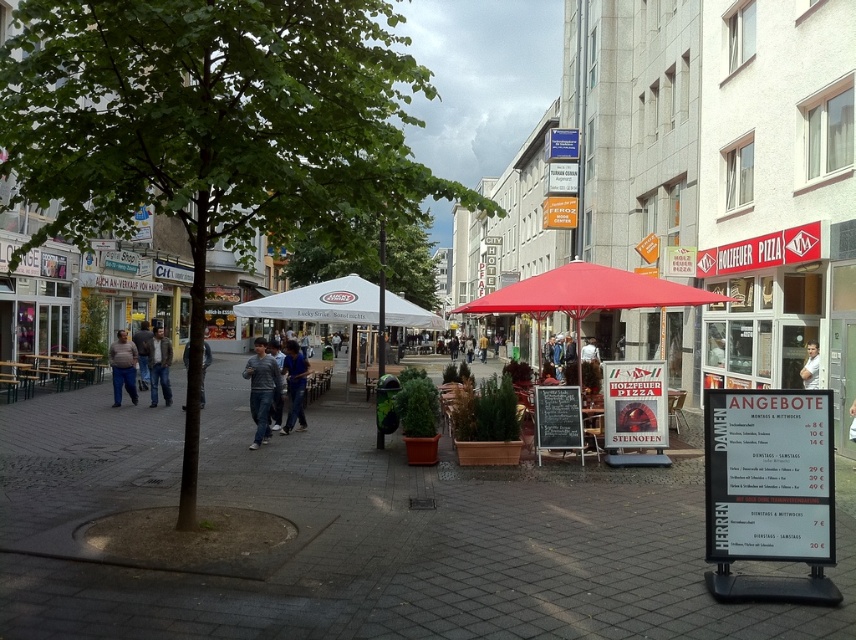
Question: Which of the following is the farthest from the observer?

Choices:
 (A) (122, 362)
 (B) (93, 624)

Answer: (A)

Question: Which of the following is the closest to the observer?

Choices:
 (A) (269, 388)
 (B) (536, 512)

Answer: (B)

Question: Which object is positioned closest to the blue jeans at center?

Choices:
 (A) dark gray sweater at center
 (B) matte gray shirt at center

Answer: (B)

Question: Does white fabric umbrella at center appear over blue jeans at center?

Choices:
 (A) no
 (B) yes

Answer: (B)

Question: Is red fabric umbrella at center positioned at the back of matte gray shirt at center?

Choices:
 (A) yes
 (B) no

Answer: (B)

Question: Can you confirm if gray cotton hoodie at center is bigger than denim jacket at center?

Choices:
 (A) yes
 (B) no

Answer: (A)